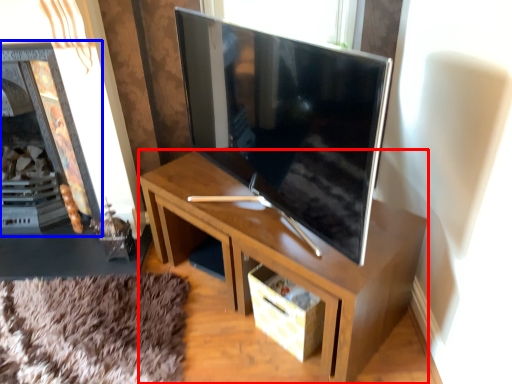
Question: Which of the following is the closest to the observer, desk (highlighted by a red box) or fireplace (highlighted by a blue box)?

Choices:
 (A) desk
 (B) fireplace

Answer: (A)